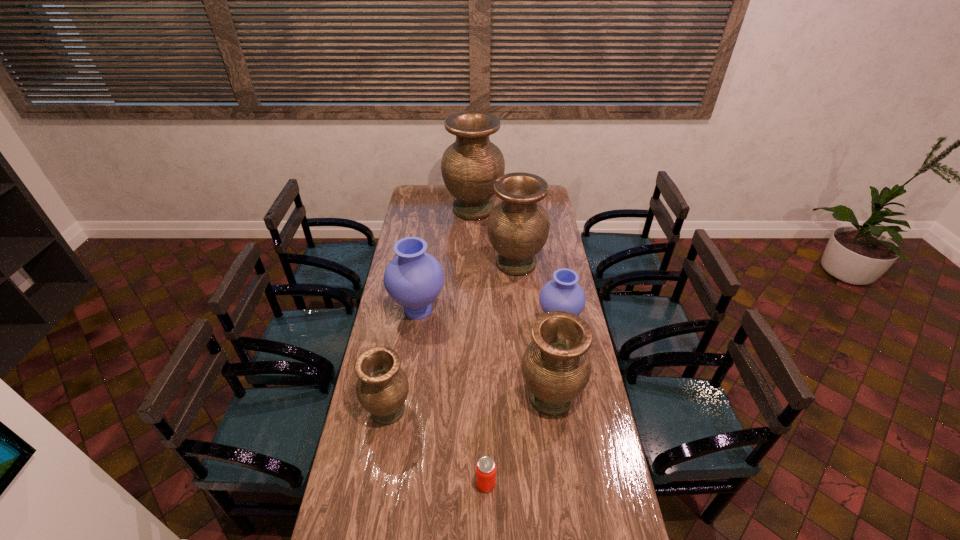
Select which vase is the closest to the left blue vase. Please provide its 2D coordinates. Your answer should be formatted as a tuple, i.e. [(x, y)], where the tuple contains the x and y coordinates of a point satisfying the conditions above.

[(518, 227)]

Point out which green vase is positioned as the second nearest to the bigger blue vase. Please provide its 2D coordinates. Your answer should be formatted as a tuple, i.e. [(x, y)], where the tuple contains the x and y coordinates of a point satisfying the conditions above.

[(382, 388)]

What are the coordinates of `green vase object that ranks as the second closest to the third biggest green vase` in the screenshot? It's located at (518, 227).